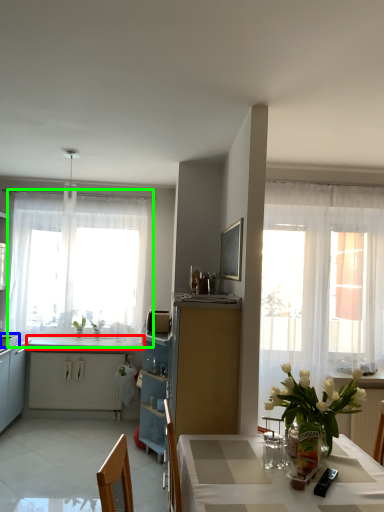
Question: Which object is the farthest from counter top (highlighted by a red box)? Choose among these: appliance (highlighted by a blue box) or window (highlighted by a green box).

Choices:
 (A) appliance
 (B) window

Answer: (B)